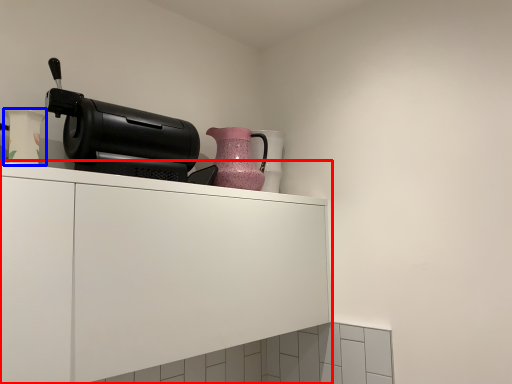
Question: Which object appears farthest to the camera in this image, cabinetry (highlighted by a red box) or vase (highlighted by a blue box)?

Choices:
 (A) cabinetry
 (B) vase

Answer: (B)